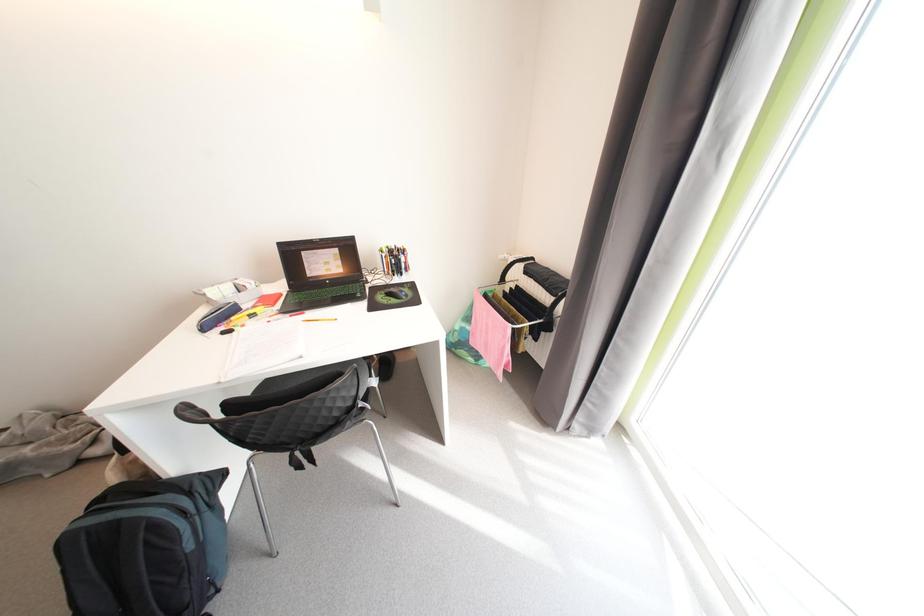
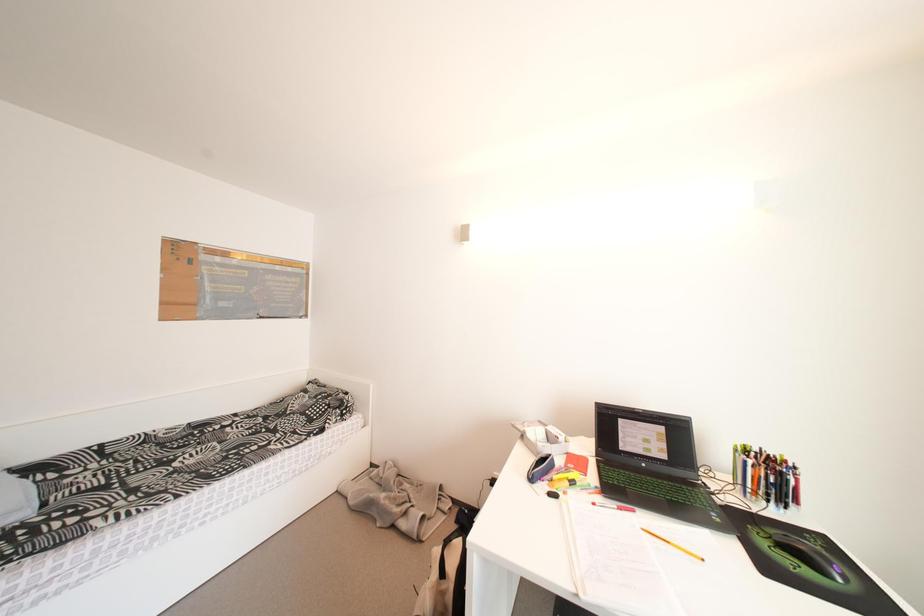
Based on the continuous images, in which direction is the camera rotating?

The camera rotated toward left-up.